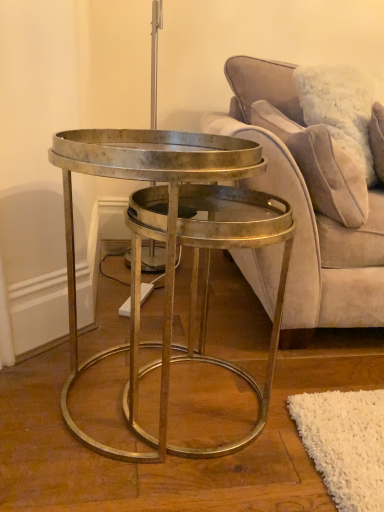
Question: In the image, is velvet beige pillow at upper right positioned in front of or behind velvet beige couch at center?

Choices:
 (A) behind
 (B) front

Answer: (A)

Question: From the image's perspective, relative to velvet beige couch at center, is velvet beige pillow at upper right above or below?

Choices:
 (A) below
 (B) above

Answer: (B)

Question: Based on their relative distances, which object is nearer to the velvet beige pillow at upper right?

Choices:
 (A) velvet beige couch at center
 (B) metallic gold coffee table at center

Answer: (A)

Question: Which of these objects is positioned closest to the velvet beige couch at center?

Choices:
 (A) metallic gold coffee table at center
 (B) velvet beige pillow at upper right

Answer: (B)